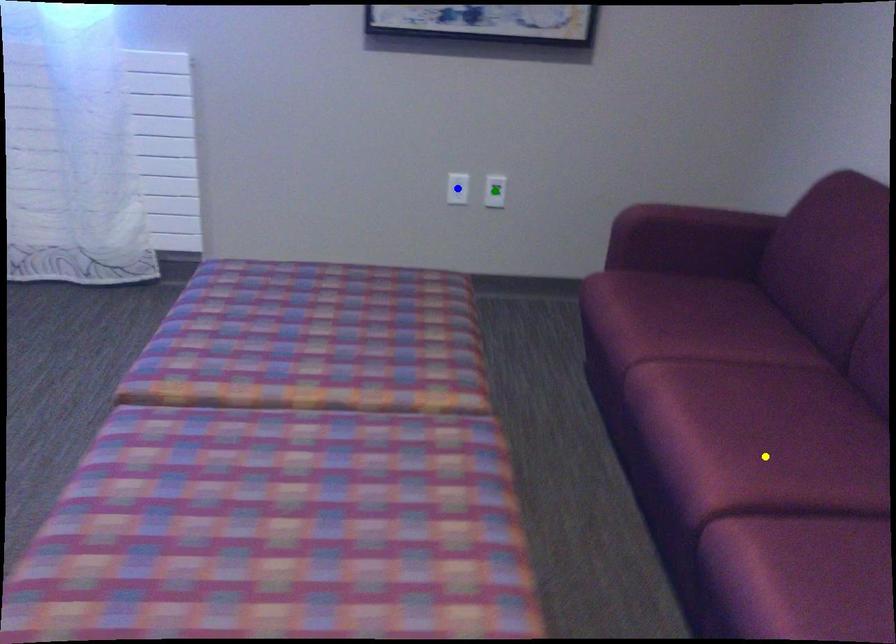
Order these from nearest to farthest:
1. blue point
2. yellow point
3. green point

1. yellow point
2. blue point
3. green point